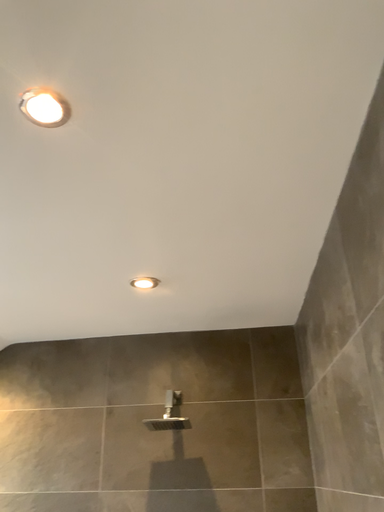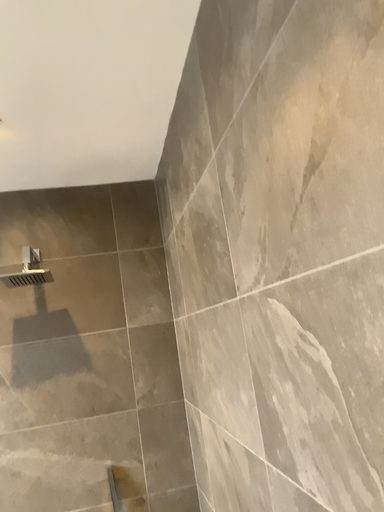
Question: Which way did the camera rotate in the video?

Choices:
 (A) rotated downward
 (B) rotated upward

Answer: (A)